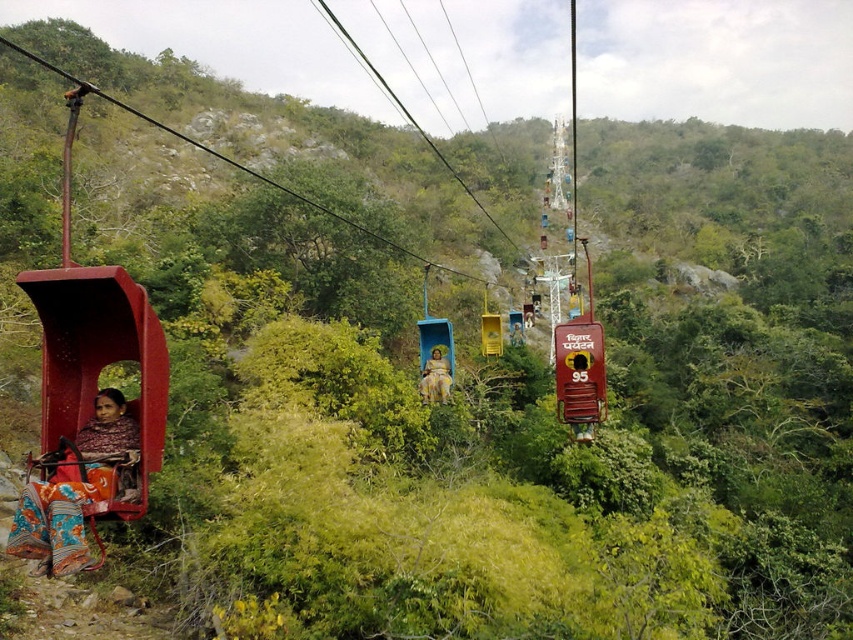
Question: Does yellow satin dress at center have a smaller size compared to yellow matte lift at center?

Choices:
 (A) yes
 (B) no

Answer: (A)

Question: Is yellow matte lift at center bigger than yellow fabric dress at center?

Choices:
 (A) no
 (B) yes

Answer: (B)

Question: Which point is closer to the camera taking this photo?

Choices:
 (A) (97, 433)
 (B) (421, 387)
 (C) (561, 195)

Answer: (A)

Question: Among these points, which one is farthest from the camera?

Choices:
 (A) coord(488,328)
 (B) coord(517,316)
 (C) coord(80,433)
 (D) coord(550,346)

Answer: (D)

Question: Which object is closer to the camera taking this photo?

Choices:
 (A) patterned fabric person at left
 (B) yellow satin dress at center

Answer: (A)

Question: Does yellow satin dress at center lie in front of yellow matte lift at center?

Choices:
 (A) yes
 (B) no

Answer: (A)